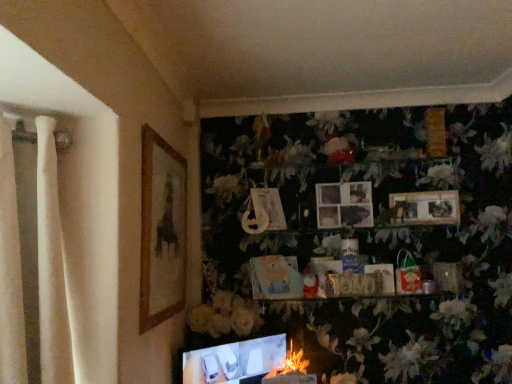
Question: Based on their positions, is matte plastic picture frame at center, the 2th picture frame viewed from the left, located to the left or right of wooden photo frame at upper center, the fifth picture frame in the left-to-right sequence?

Choices:
 (A) left
 (B) right

Answer: (A)

Question: Is matte plastic picture frame at center, the fourth picture frame in the right-to-left sequence, inside or outside of wooden photo frame at upper center, the 1th picture frame in the right-to-left sequence?

Choices:
 (A) outside
 (B) inside

Answer: (A)

Question: Based on their relative distances, which object is nearer to the fluffy white flower at lower center, the first flower in the right-to-left sequence?

Choices:
 (A) white matte flower at center, the second flower when ordered from right to left
 (B) matte plastic picture frame at center, the 2th picture frame viewed from the left
 (C) wooden photo frame at upper center, the fifth picture frame in the left-to-right sequence
 (D) wooden picture frame at left, which is the first picture frame in left-to-right order
 (E) matte black laptop at lower center

Answer: (E)

Question: Estimate the real-world distances between objects in this image. Which object is farther from the fluffy white flower at lower center, the first flower in the right-to-left sequence?

Choices:
 (A) white matte flower at center, the second flower when ordered from right to left
 (B) wooden photo frame at upper center, the 1th picture frame in the right-to-left sequence
 (C) matte cardboard picture frame at center, arranged as the third picture frame when viewed from the right
 (D) wooden picture frame at left, the fifth picture frame positioned from the right
 (E) matte black laptop at lower center

Answer: (B)